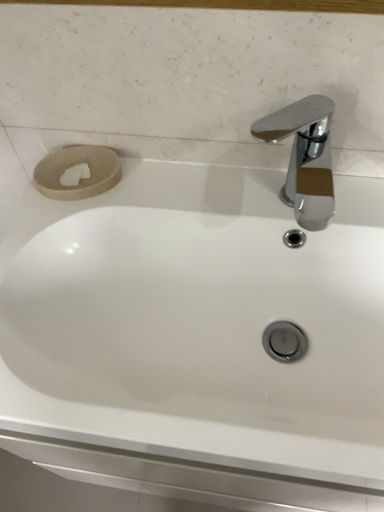
Question: Is chrome/metallic faucet at upper right positioned with its back to beige matte toilet paper at upper left?

Choices:
 (A) no
 (B) yes

Answer: (A)

Question: From the image's perspective, is chrome/metallic faucet at upper right below beige matte toilet paper at upper left?

Choices:
 (A) no
 (B) yes

Answer: (B)

Question: From the image's perspective, is chrome/metallic faucet at upper right on beige matte toilet paper at upper left?

Choices:
 (A) no
 (B) yes

Answer: (A)

Question: Does chrome/metallic faucet at upper right have a greater height compared to beige matte toilet paper at upper left?

Choices:
 (A) yes
 (B) no

Answer: (A)

Question: Is chrome/metallic faucet at upper right to the right of beige matte toilet paper at upper left from the viewer's perspective?

Choices:
 (A) no
 (B) yes

Answer: (B)

Question: Would you consider chrome/metallic faucet at upper right to be distant from beige matte toilet paper at upper left?

Choices:
 (A) no
 (B) yes

Answer: (B)

Question: Is beige matte toilet paper at upper left directly adjacent to chrome/metallic faucet at upper right?

Choices:
 (A) yes
 (B) no

Answer: (B)

Question: Does beige matte toilet paper at upper left appear on the left side of chrome/metallic faucet at upper right?

Choices:
 (A) yes
 (B) no

Answer: (A)

Question: Is beige matte toilet paper at upper left behind chrome/metallic faucet at upper right?

Choices:
 (A) no
 (B) yes

Answer: (B)

Question: From the image's perspective, is beige matte toilet paper at upper left on chrome/metallic faucet at upper right?

Choices:
 (A) no
 (B) yes

Answer: (B)

Question: Is beige matte toilet paper at upper left wider than chrome/metallic faucet at upper right?

Choices:
 (A) no
 (B) yes

Answer: (A)

Question: From a real-world perspective, is beige matte toilet paper at upper left on top of chrome/metallic faucet at upper right?

Choices:
 (A) yes
 (B) no

Answer: (B)

Question: From the image's perspective, is beige matte toilet paper at upper left positioned above or below chrome/metallic faucet at upper right?

Choices:
 (A) above
 (B) below

Answer: (A)